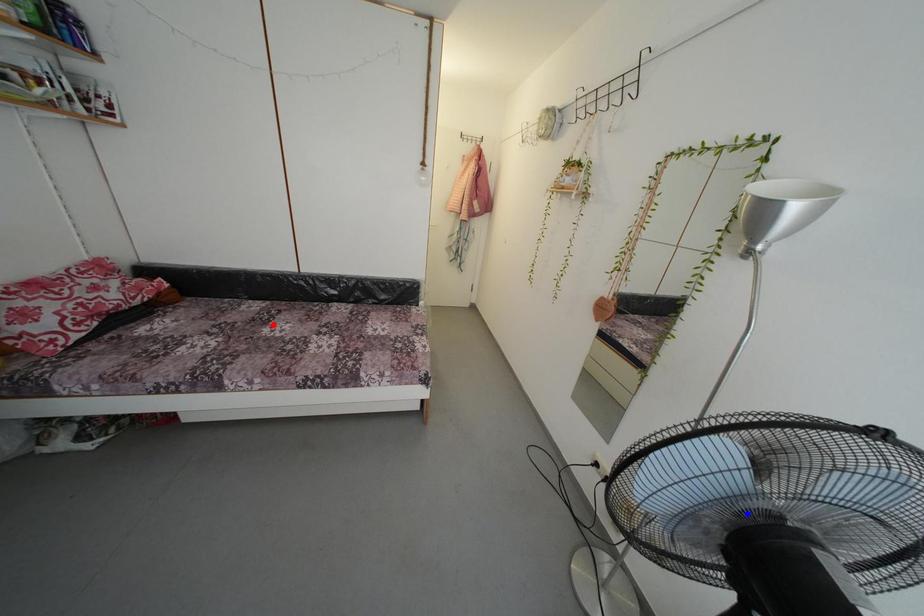
Question: Which of the two points in the image is closer to the camera?

Choices:
 (A) Blue point is closer.
 (B) Red point is closer.

Answer: (A)